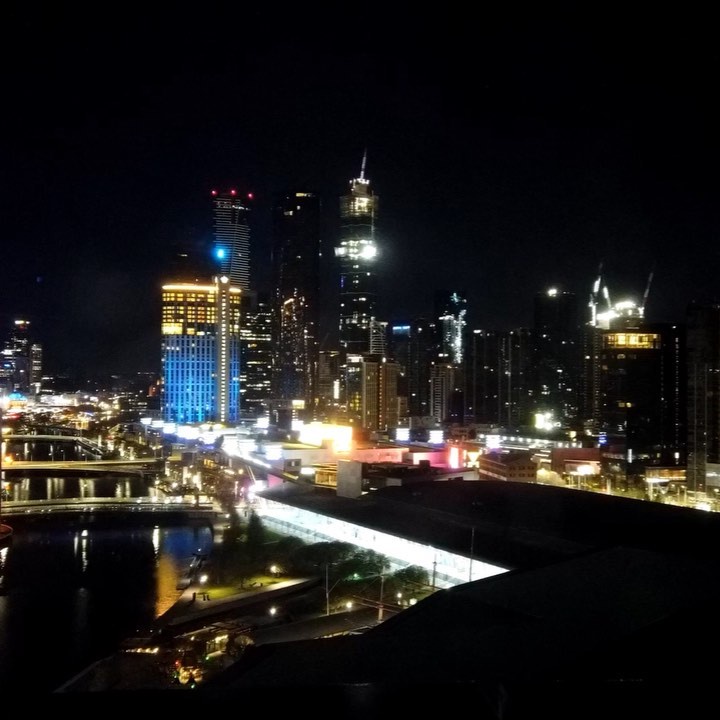
You are a GUI agent. You are given a task and a screenshot of the screen. Output one action in this format:
    pyautogui.click(x=<x>, y=<y>)
    Task: Click on the blue lights
    
    Given the screenshot: What is the action you would take?
    pyautogui.click(x=219, y=253), pyautogui.click(x=174, y=405), pyautogui.click(x=194, y=405), pyautogui.click(x=210, y=402)